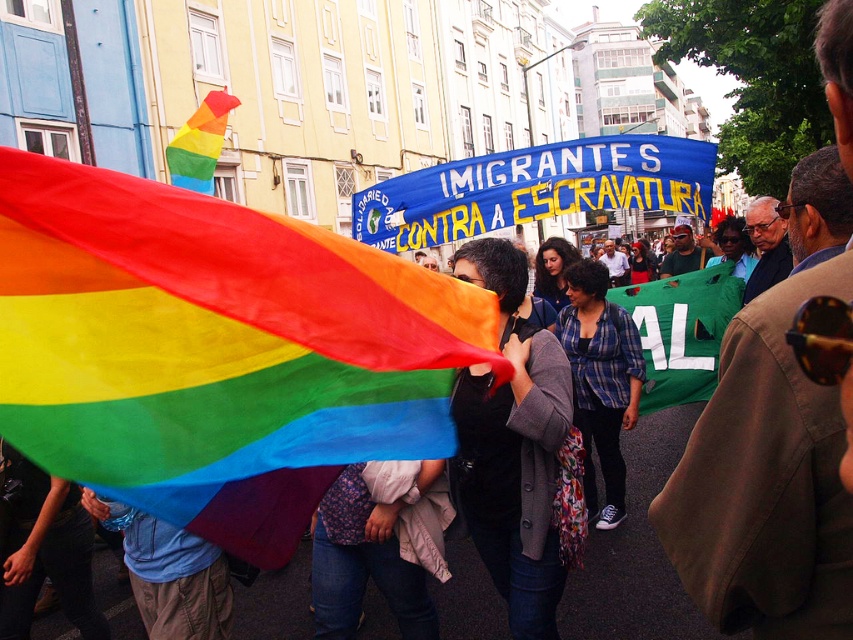
You are a photographer capturing the protest scene. You notice the matte black jacket at center and the green fabric banner at center. Which object is positioned to the left of the other?

The matte black jacket at center is to the left of the green fabric banner at center.

You are a photographer standing at the point marked by the coordinates point (x=512, y=445). You want to take a photo of the rainbow flag in the foreground and the banner in the midground. Which object is closer to you?

The point (x=512, y=445) marks matte black jacket at center, which is located between the rainbow flag in the foreground and the banner in the midground. Since the rainbow flag is in the foreground, it is closer to the photographer than the banner in the midground.

You are a photographer trying to capture the rainbow fabric flag at center and the matte black jacket at center in the same frame. Which object should you zoom in on to ensure both are clearly visible?

The rainbow fabric flag at center is thinner than the matte black jacket at center, so zooming in on the matte black jacket at center will allow both objects to be visible while maintaining clarity.